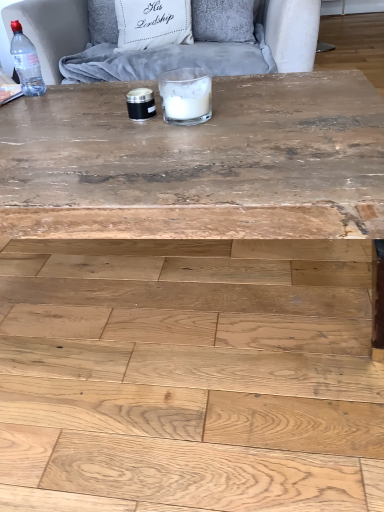
Question: Is transparent plastic bottle at top left in contact with white glass candle at center?

Choices:
 (A) yes
 (B) no

Answer: (B)

Question: Could you tell me if transparent plastic bottle at top left is turned towards white glass candle at center?

Choices:
 (A) no
 (B) yes

Answer: (A)

Question: Is transparent plastic bottle at top left positioned in front of white glass candle at center?

Choices:
 (A) no
 (B) yes

Answer: (A)

Question: From the image's perspective, is transparent plastic bottle at top left over white glass candle at center?

Choices:
 (A) no
 (B) yes

Answer: (B)

Question: Is transparent plastic bottle at top left far from white glass candle at center?

Choices:
 (A) no
 (B) yes

Answer: (A)

Question: From the image's perspective, is velvet grey armchair at upper center located above or below transparent plastic bottle at top left?

Choices:
 (A) above
 (B) below

Answer: (A)

Question: In the image, is velvet grey armchair at upper center on the left side or the right side of transparent plastic bottle at top left?

Choices:
 (A) right
 (B) left

Answer: (A)

Question: Choose the correct answer: Is velvet grey armchair at upper center inside transparent plastic bottle at top left or outside it?

Choices:
 (A) inside
 (B) outside

Answer: (B)

Question: Considering the positions of point (13, 9) and point (11, 42), is point (13, 9) closer or farther from the camera than point (11, 42)?

Choices:
 (A) farther
 (B) closer

Answer: (A)

Question: Is velvet grey armchair at upper center to the left or to the right of white glass candle at center in the image?

Choices:
 (A) right
 (B) left

Answer: (B)

Question: Is velvet grey armchair at upper center taller or shorter than white glass candle at center?

Choices:
 (A) tall
 (B) short

Answer: (A)

Question: From a real-world perspective, is velvet grey armchair at upper center positioned above or below white glass candle at center?

Choices:
 (A) above
 (B) below

Answer: (B)

Question: Considering their positions, is velvet grey armchair at upper center located in front of or behind white glass candle at center?

Choices:
 (A) front
 (B) behind

Answer: (B)

Question: Considering the positions of transparent plastic bottle at top left and natural wood plywood at lower center in the image, is transparent plastic bottle at top left taller or shorter than natural wood plywood at lower center?

Choices:
 (A) short
 (B) tall

Answer: (B)

Question: Looking at the image, does transparent plastic bottle at top left seem bigger or smaller compared to natural wood plywood at lower center?

Choices:
 (A) big
 (B) small

Answer: (B)